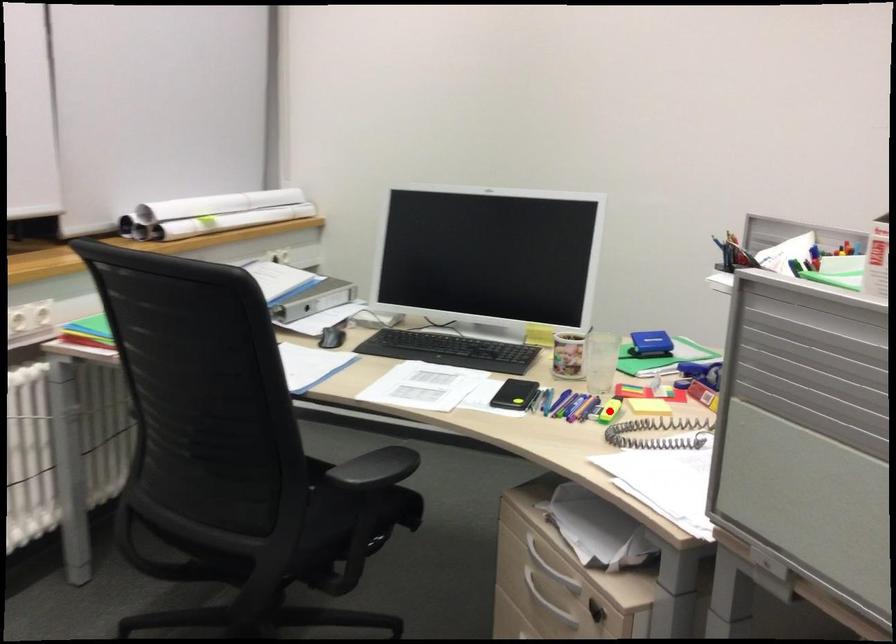
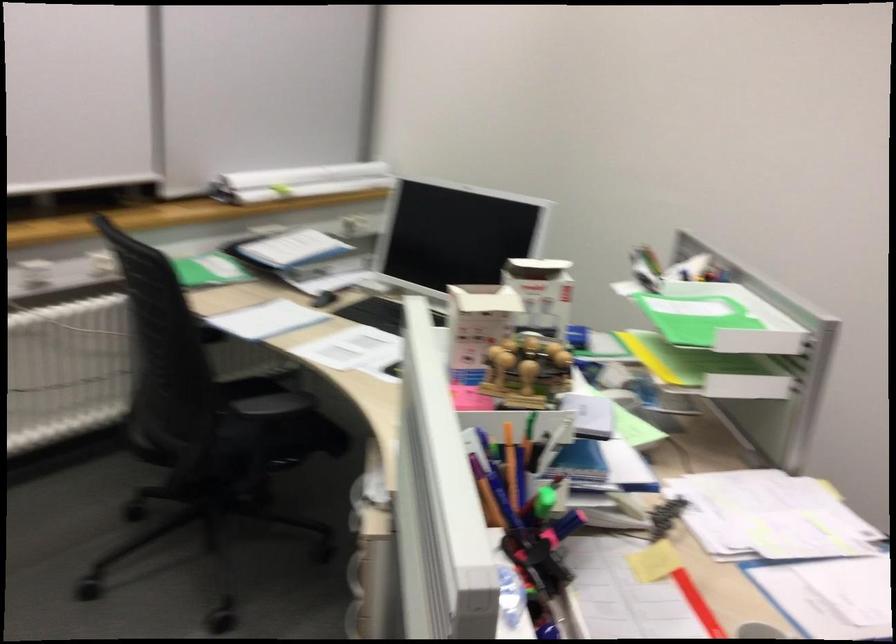
Question: I am providing you with two images of the same scene from different viewpoints. A red point is marked on the first image. At the location where the point appears in image 1, is it still visible in image 2?

Choices:
 (A) Yes
 (B) No

Answer: (B)